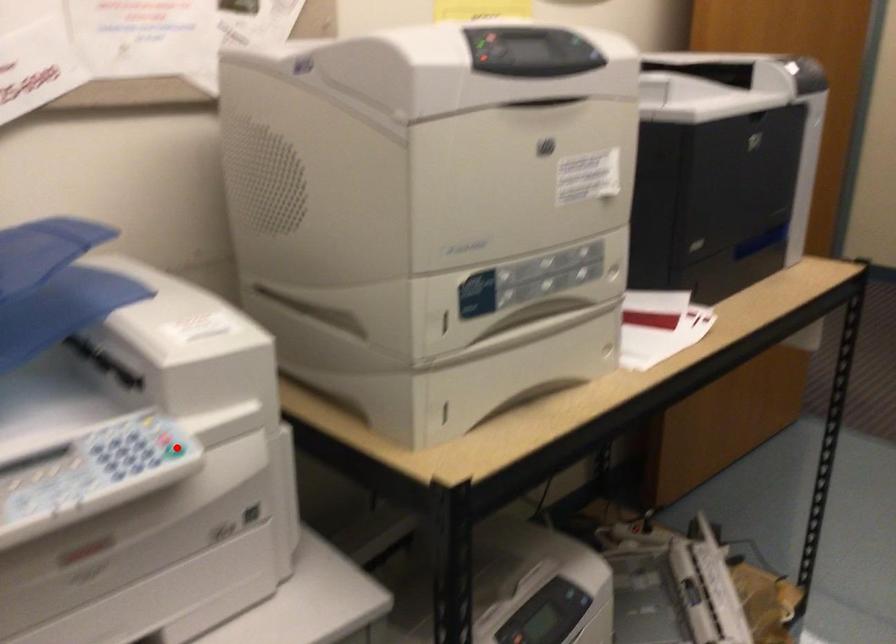
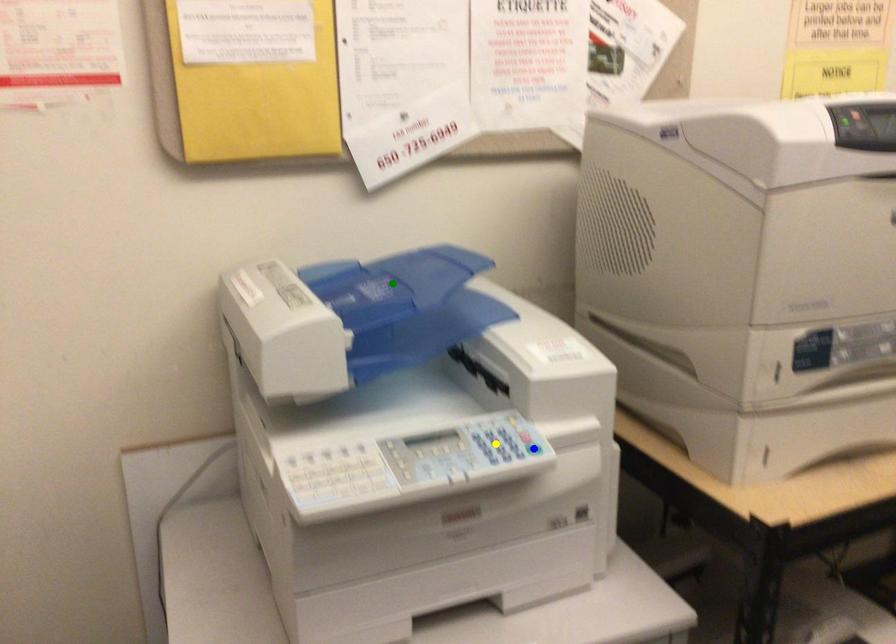
Question: I am providing you with two images of the same scene from different viewpoints. A red point is marked on the first image. You are given multiple points on the second image. In image 2, which mark is for the same physical point as the one in image 1?

Choices:
 (A) yellow point
 (B) green point
 (C) blue point

Answer: (C)